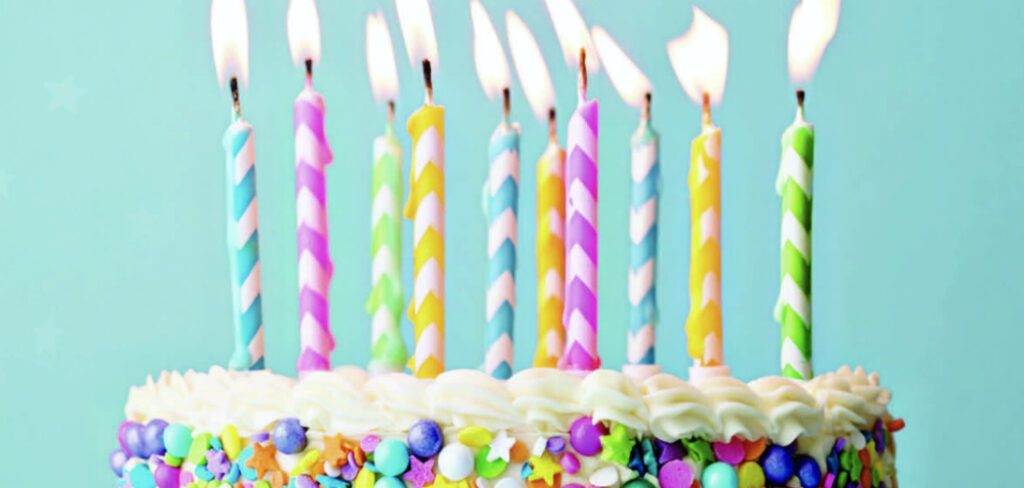
Locate an element on the screen. lit birthday candles with different colored stripes on each one is located at coordinates [x=798, y=217], [x=707, y=235], [x=643, y=267], [x=588, y=295], [x=554, y=314], [x=503, y=325], [x=427, y=334], [x=390, y=338], [x=319, y=337], [x=256, y=336].